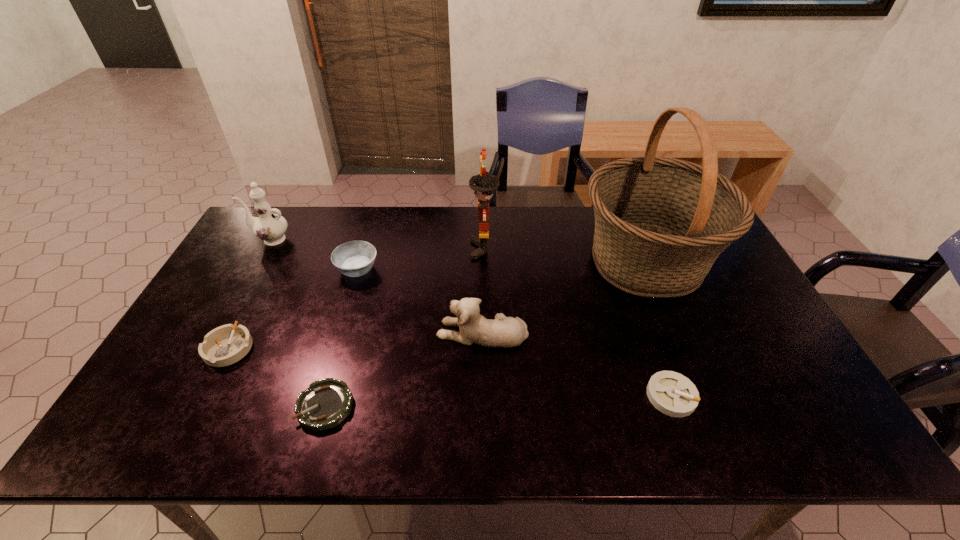
Identify the location of the tallest object. (660, 223).

The height and width of the screenshot is (540, 960). In order to click on nutcracker in this screenshot , I will do `click(483, 184)`.

Identify the location of the third tallest object. (269, 227).

Where is `the fourth tallest object`? This screenshot has width=960, height=540. the fourth tallest object is located at coordinates point(503,331).

This screenshot has height=540, width=960. Find the location of `the tallest ashtray`. the tallest ashtray is located at coordinates (354, 258).

Find the location of `the fifth tallest object`. the fifth tallest object is located at coordinates (354, 258).

I want to click on the leftmost ashtray, so click(x=225, y=345).

Locate an element on the screen. the rightmost ashtray is located at coordinates (673, 394).

Identify the location of the shortest object. (327, 402).

You are a GUI agent. You are given a task and a screenshot of the screen. Output one action in this format:
    pyautogui.click(x=<x>, y=<y>)
    Task: Click on the vacant space positioned 0.170m on the left of the basket
    The width and height of the screenshot is (960, 540).
    Given the screenshot: What is the action you would take?
    pyautogui.click(x=524, y=262)